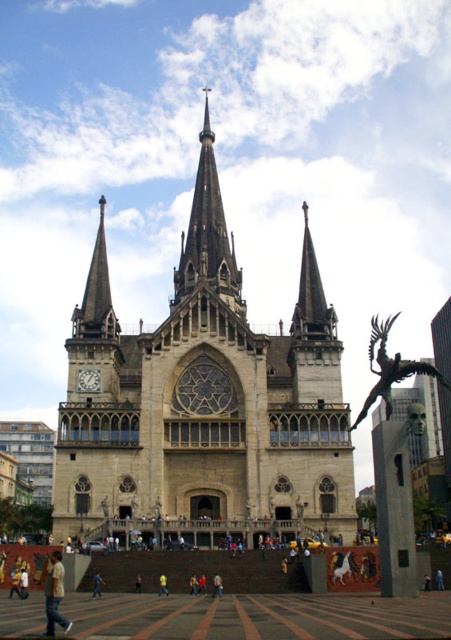
Is dark gray stone spire at center to the left of smooth gray steeple at upper left from the viewer's perspective?

In fact, dark gray stone spire at center is to the right of smooth gray steeple at upper left.

This screenshot has width=451, height=640. I want to click on dark gray stone spire at center, so click(207, 236).

Is stone church at center wider than matte gray clock at center?

Yes, stone church at center is wider than matte gray clock at center.

Is stone church at center behind matte gray clock at center?

No, stone church at center is in front of matte gray clock at center.

Does point (339, 506) come farther from viewer compared to point (83, 380)?

No, it is in front of (83, 380).

In order to click on stone church at center in this screenshot , I will do `click(205, 401)`.

Is smooth gray steeple at upper left smaller than bronze/statue at right?

Yes.

Is smooth gray steeple at upper left thinner than bronze/statue at right?

Indeed, smooth gray steeple at upper left has a lesser width compared to bronze/statue at right.

Which is behind, point (101, 305) or point (400, 374)?

The point (101, 305) is behind.

In order to click on smooth gray steeple at upper left in this screenshot , I will do `click(96, 296)`.